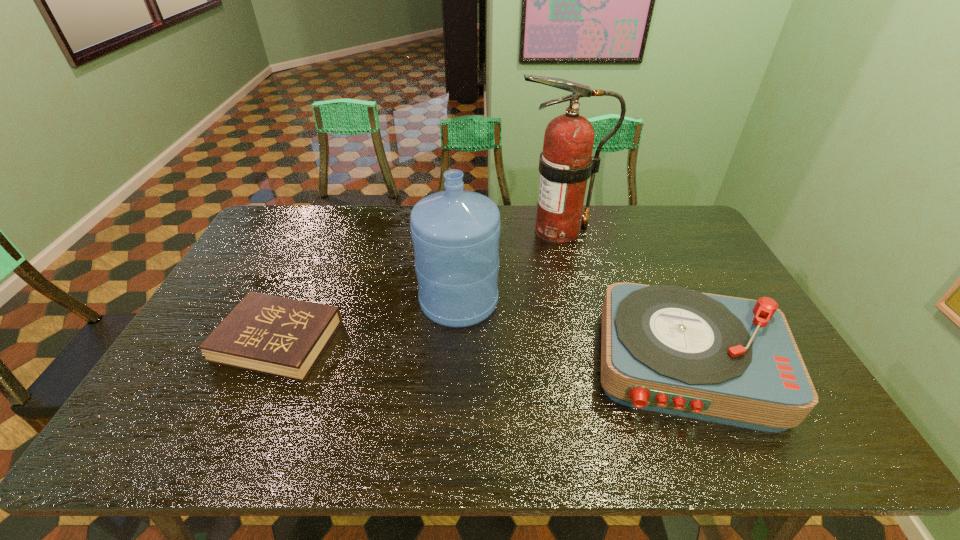
Where is `free spot between the farthest object and the second object from left to right`? The width and height of the screenshot is (960, 540). free spot between the farthest object and the second object from left to right is located at coordinates (508, 266).

I want to click on free space between the third shortest object and the record player, so click(x=573, y=332).

You are a GUI agent. You are given a task and a screenshot of the screen. Output one action in this format:
    pyautogui.click(x=<x>, y=<y>)
    Task: Click on the unoccupied position between the shortest object and the tallest object
    
    Given the screenshot: What is the action you would take?
    pyautogui.click(x=418, y=286)

Find the location of `vacant area that lies between the tallest object and the leftmost object`. vacant area that lies between the tallest object and the leftmost object is located at coordinates (418, 286).

At what (x,y) coordinates should I click in order to perform the action: click on object that is the third closest to the third object from right to left. Please return your answer as a coordinate pair (x, y). Looking at the image, I should click on [664, 348].

Identify the location of object that ranks as the second closest to the second shortest object. (566, 163).

Locate an element on the screen. Image resolution: width=960 pixels, height=540 pixels. free point that satisfies the following two spatial constraints: 1. at the nozzle of the tallest object; 2. on the back side of the second shortest object is located at coordinates (588, 363).

This screenshot has width=960, height=540. In order to click on vacant point that satisfies the following two spatial constraints: 1. at the nozzle of the third tallest object; 2. on the left side of the farthest object in this screenshot , I will do `click(588, 363)`.

At what (x,y) coordinates should I click in order to perform the action: click on blank area in the image that satisfies the following two spatial constraints: 1. at the nozzle of the farthest object; 2. on the right side of the record player. Please return your answer as a coordinate pair (x, y). The height and width of the screenshot is (540, 960). Looking at the image, I should click on (588, 363).